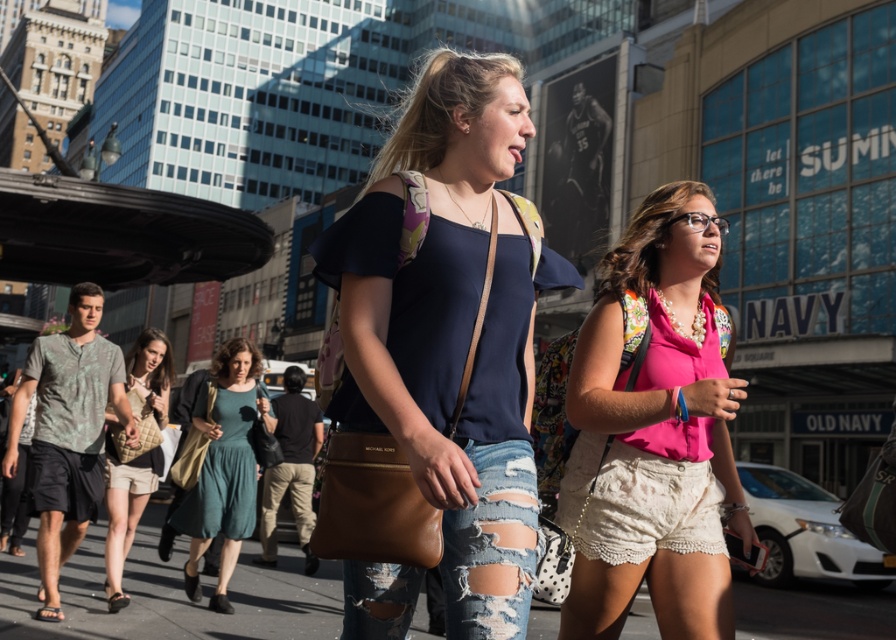
You are a photographer standing at the edge of the street. You want to take a photo that includes both the ripped denim jeans at center and the beige quilted purse at center. Which object should you focus on first if you want to ensure both are in sharp focus?

The ripped denim jeans at center is shorter than the beige quilted purse at center. To ensure both are in sharp focus, you should focus on the beige quilted purse at center because it is farther away, which will keep the closer ripped denim jeans at center in focus as well within the depth of field.